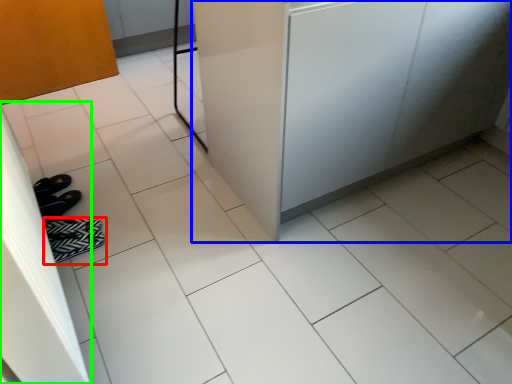
Question: Considering the real-world distances, which object is farthest from footwear (highlighted by a red box)? counter (highlighted by a blue box) or screen door (highlighted by a green box)?

Choices:
 (A) counter
 (B) screen door

Answer: (A)